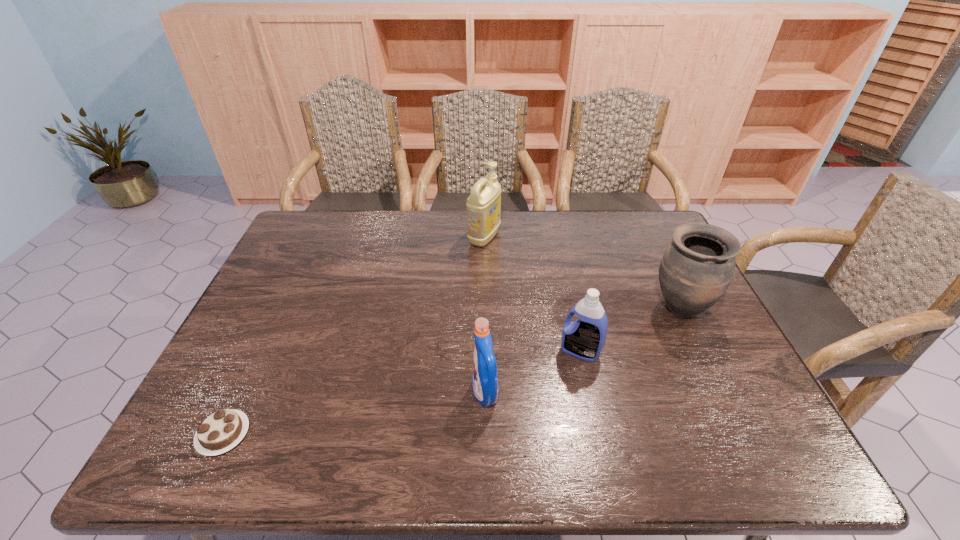
This screenshot has height=540, width=960. What are the coordinates of `the tallest detergent` in the screenshot? It's located at (483, 205).

Find the location of a particular element. the farthest object is located at coordinates (483, 205).

Locate an element on the screen. This screenshot has height=540, width=960. the second farthest object is located at coordinates (697, 267).

Locate an element on the screen. The width and height of the screenshot is (960, 540). the rightmost object is located at coordinates (697, 267).

Locate an element on the screen. This screenshot has height=540, width=960. the third farthest object is located at coordinates (584, 338).

Locate an element on the screen. This screenshot has width=960, height=540. the second nearest detergent is located at coordinates (584, 338).

Find the location of `the nearest detergent`. the nearest detergent is located at coordinates coord(485,386).

Locate an element on the screen. The height and width of the screenshot is (540, 960). the shortest object is located at coordinates (224, 429).

Where is `the leftmost object`? the leftmost object is located at coordinates (224, 429).

Identify the location of vacant space located 0.230m on the right of the farthest detergent. This screenshot has width=960, height=540. (569, 237).